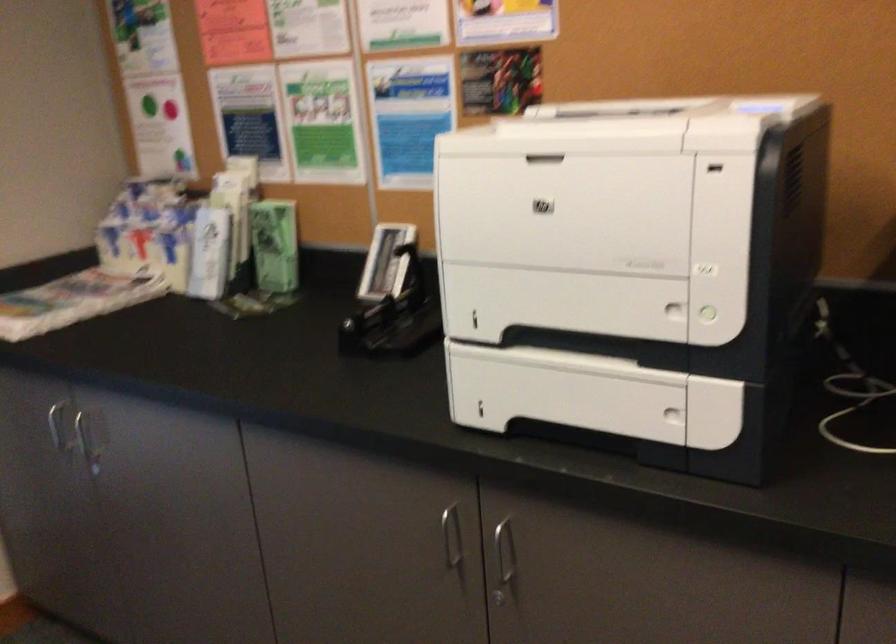
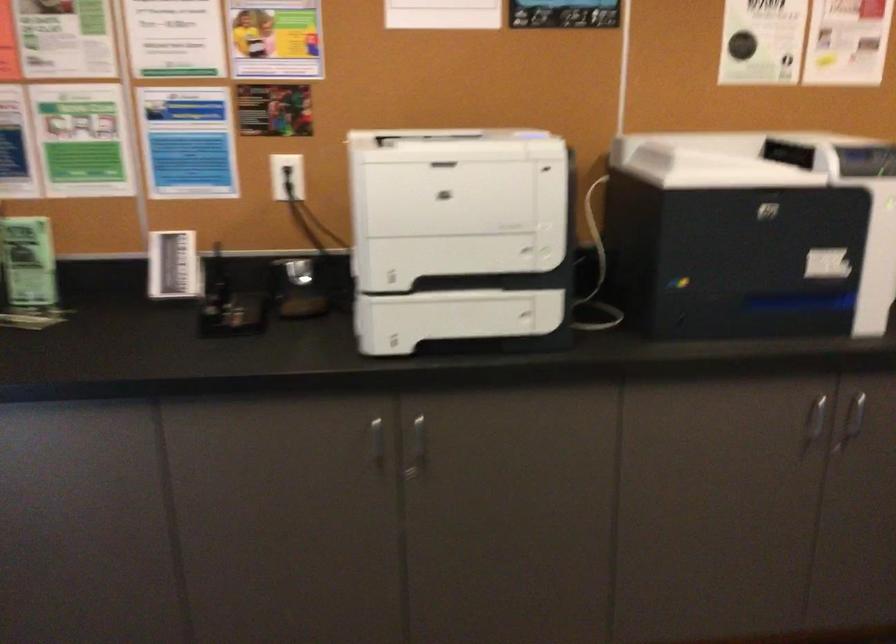
Locate, in the second image, the point that corresponds to [510,567] in the first image.

(417, 448)